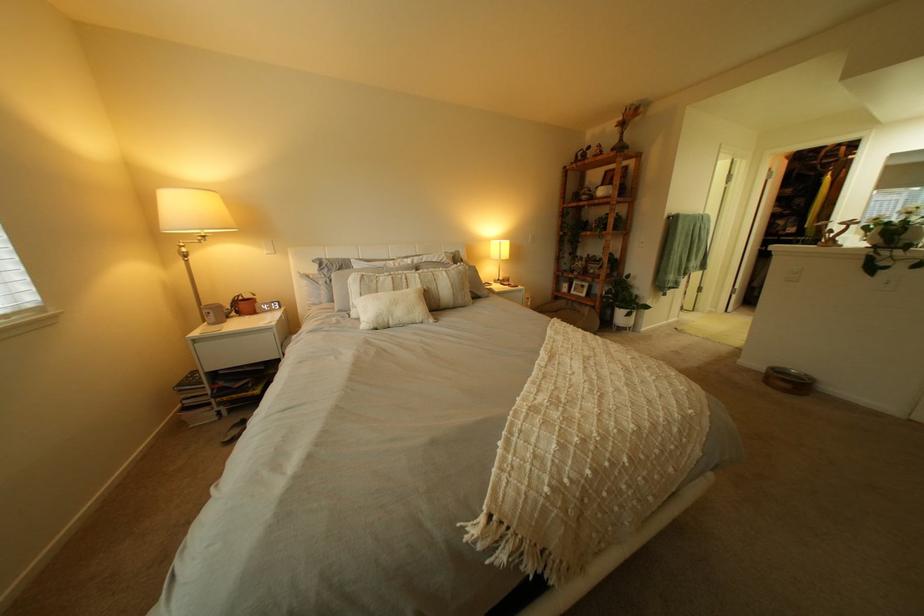
Locate an element on the screen. Image resolution: width=924 pixels, height=616 pixels. striped pillow is located at coordinates (418, 285).